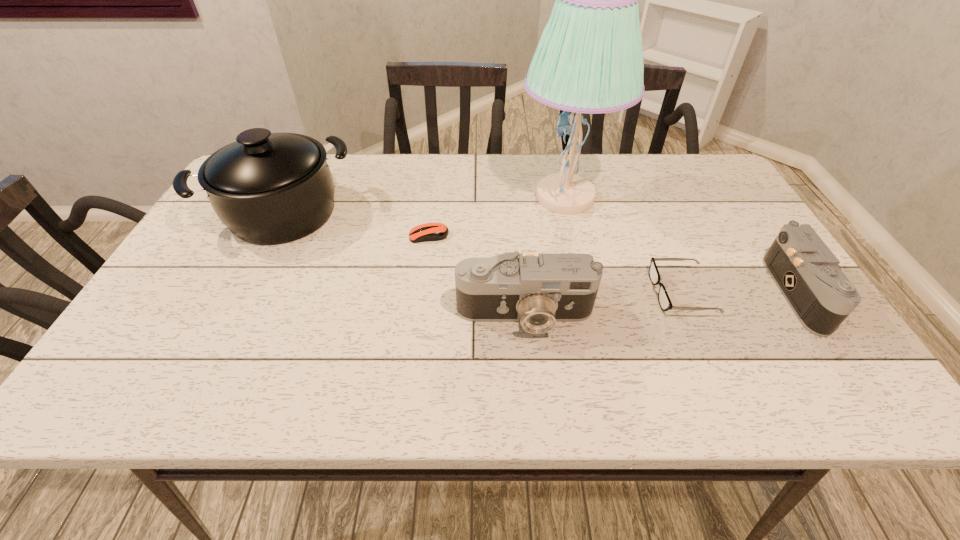
Identify the location of object located at the right edge. This screenshot has width=960, height=540. (808, 274).

Identify the location of object present at the far left corner. The image size is (960, 540). (268, 188).

Identify the location of object that is at the near right corner. This screenshot has height=540, width=960. (808, 274).

At what (x,y) coordinates should I click in order to perform the action: click on vacant region at the far edge of the desktop. Please return your answer as a coordinate pair (x, y). The width and height of the screenshot is (960, 540). Looking at the image, I should click on (386, 163).

In the image, there is a desktop. Where is `vacant area at the near edge`? vacant area at the near edge is located at coordinates (282, 342).

Identify the location of empty space between the computer mouse and the lamp. (497, 217).

At what (x,y) coordinates should I click in order to perform the action: click on free space that is in between the second tallest object and the fifth object from left to right. Please return your answer as a coordinate pair (x, y). Looking at the image, I should click on tap(482, 253).

Image resolution: width=960 pixels, height=540 pixels. Identify the location of blank region between the second object from right to left and the fourth tallest object. (741, 293).

This screenshot has height=540, width=960. I want to click on vacant area that lies between the tallest object and the spectacles, so click(x=623, y=245).

Where is `free space between the tallest object and the saucepan`? The width and height of the screenshot is (960, 540). free space between the tallest object and the saucepan is located at coordinates (424, 205).